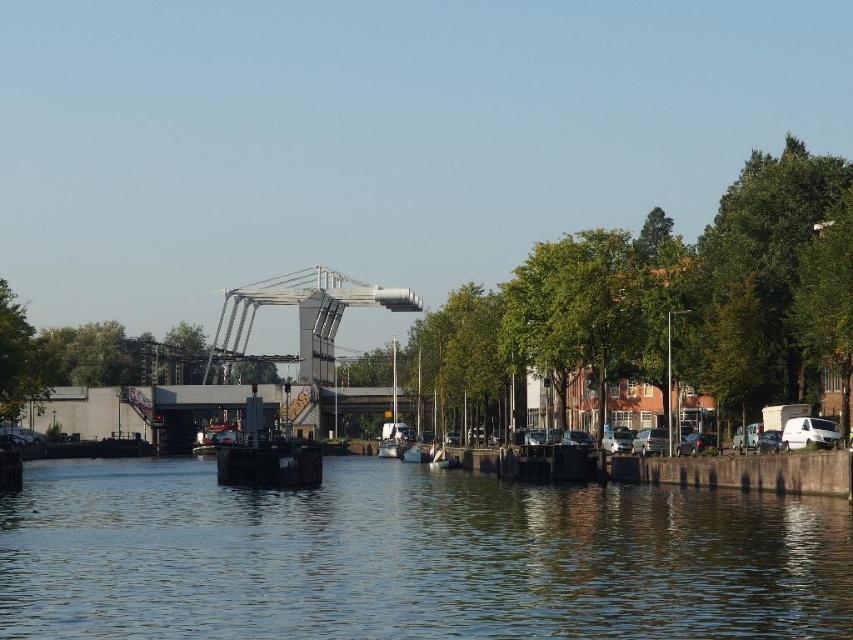
Can you confirm if blue water at center is positioned above green leafy tree at left?

No, blue water at center is not above green leafy tree at left.

Between point (25, 492) and point (9, 417), which one is positioned in front?

Point (25, 492) is in front.

Where is `blue water at center`? This screenshot has height=640, width=853. blue water at center is located at coordinates (410, 556).

Is metallic gray boat at center thinner than green leafy tree at left?

Indeed, metallic gray boat at center has a lesser width compared to green leafy tree at left.

Who is positioned more to the left, metallic gray boat at center or green leafy tree at left?

Positioned to the left is green leafy tree at left.

This screenshot has width=853, height=640. What do you see at coordinates (267, 456) in the screenshot? I see `metallic gray boat at center` at bounding box center [267, 456].

Identify the location of metallic gray boat at center. (267, 456).

Does blue water at center have a smaller size compared to metallic gray boat at center?

Actually, blue water at center might be larger than metallic gray boat at center.

Is point (833, 628) positioned after point (316, 481)?

No, it is in front of (316, 481).

This screenshot has height=640, width=853. What are the coordinates of `blue water at center` in the screenshot? It's located at (410, 556).